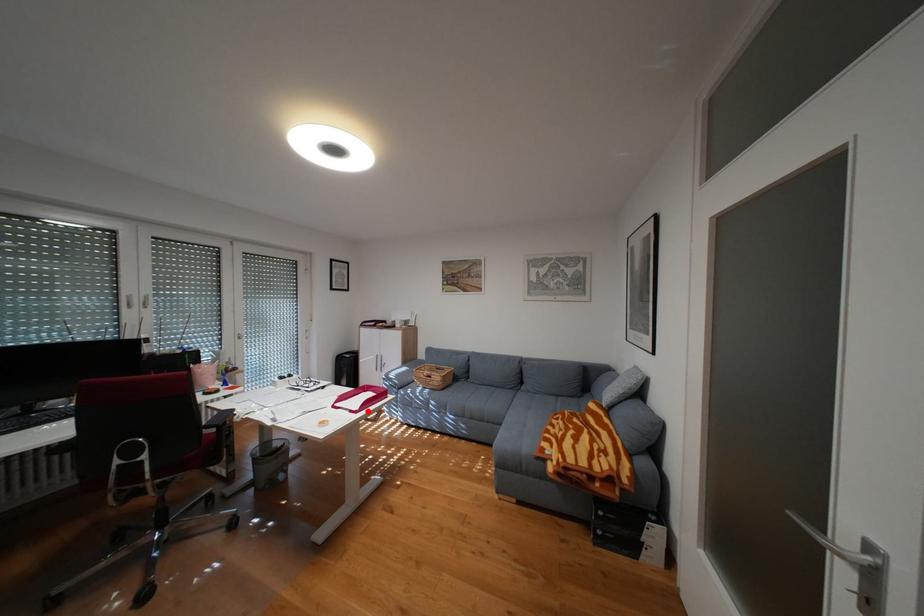
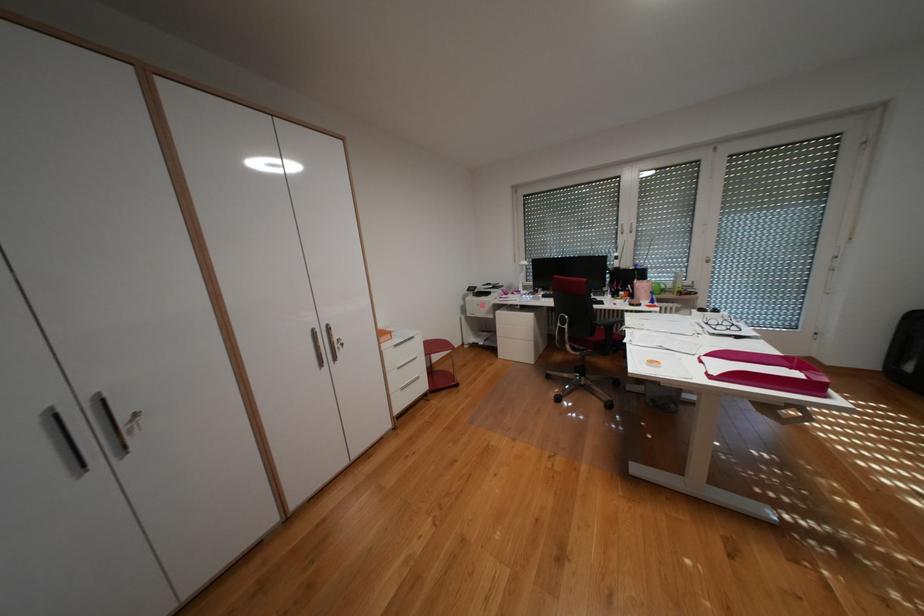
Where in the second image is the point corresponding to the highlighted location from the first image?

(723, 377)